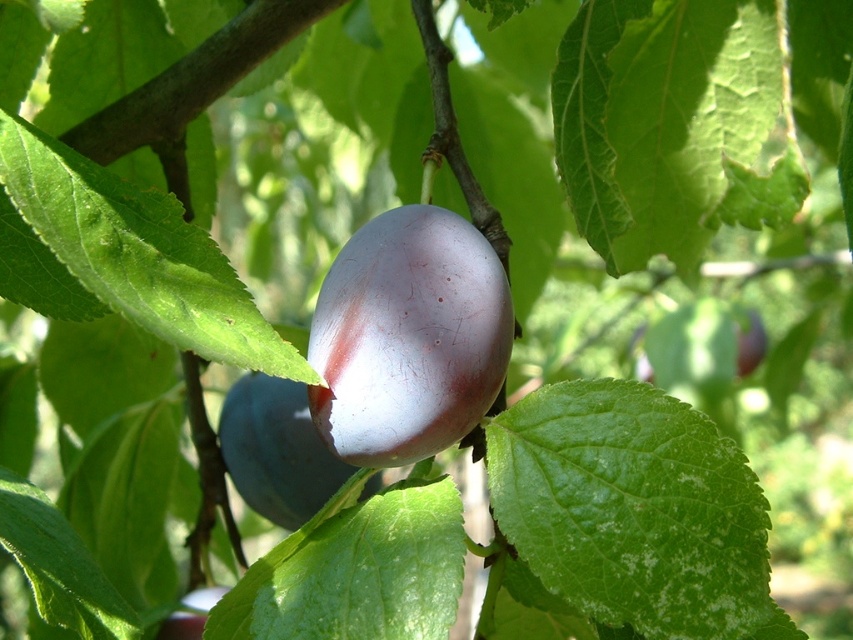
Question: Where is purple glossy plum at center located in relation to shiny purple plum at center in the image?

Choices:
 (A) above
 (B) below

Answer: (A)

Question: Can you confirm if purple glossy plum at center is smaller than shiny purple plum at center?

Choices:
 (A) no
 (B) yes

Answer: (B)

Question: Which of the following is the farthest from the observer?

Choices:
 (A) (318, 451)
 (B) (397, 349)

Answer: (A)

Question: Does purple glossy plum at center have a greater width compared to shiny purple plum at center?

Choices:
 (A) yes
 (B) no

Answer: (B)

Question: Which point is closer to the camera?

Choices:
 (A) (352, 260)
 (B) (225, 451)

Answer: (A)